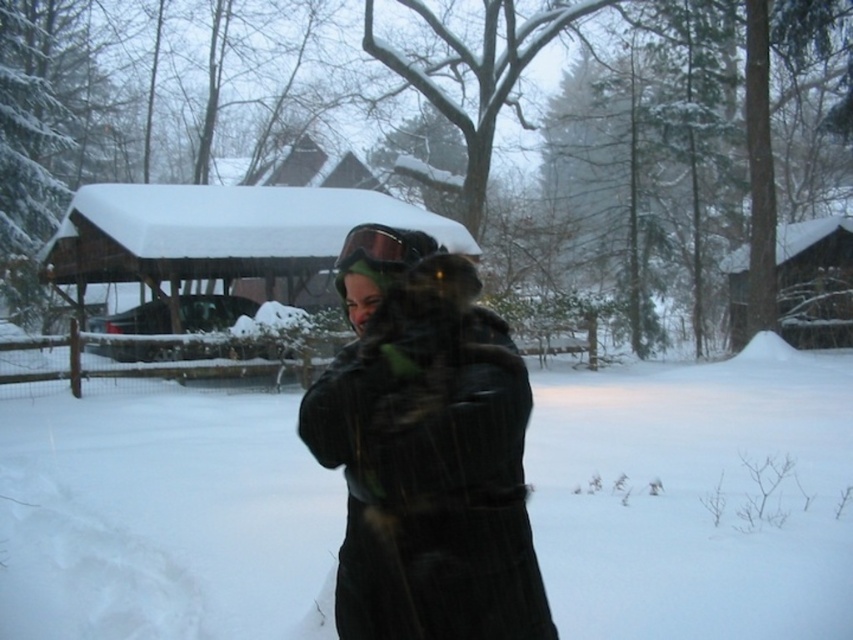
Question: Based on their relative distances, which object is farther from the green matte goggles at center?

Choices:
 (A) wooden cabin at center
 (B) white fluffy snow at center

Answer: (B)

Question: Which point appears closest to the camera in this image?

Choices:
 (A) (99, 257)
 (B) (387, 269)

Answer: (B)

Question: Considering the relative positions of wooden cabin at center and green matte goggles at center in the image provided, where is wooden cabin at center located with respect to green matte goggles at center?

Choices:
 (A) right
 (B) left

Answer: (B)

Question: Is white fluffy snow at center positioned in front of wooden cabin at center?

Choices:
 (A) no
 (B) yes

Answer: (B)

Question: Can you confirm if white fluffy snow at center is thinner than green matte goggles at center?

Choices:
 (A) no
 (B) yes

Answer: (A)

Question: Which point is closer to the camera taking this photo?

Choices:
 (A) (822, 374)
 (B) (378, 253)
 (C) (314, 276)

Answer: (B)